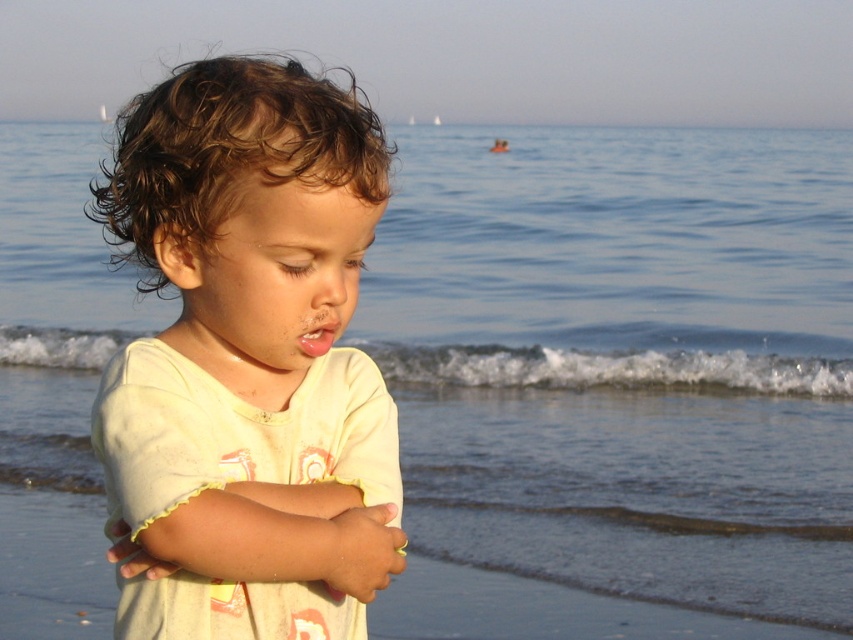
Is light yellow cotton shirt at center above pink matte lips at center?

Yes.

Who is more forward, (347, 218) or (316, 330)?

Point (347, 218) is more forward.

Is point (223, 616) less distant than point (306, 356)?

Yes, it is in front of point (306, 356).

The height and width of the screenshot is (640, 853). In order to click on light yellow cotton shirt at center in this screenshot , I will do `click(248, 358)`.